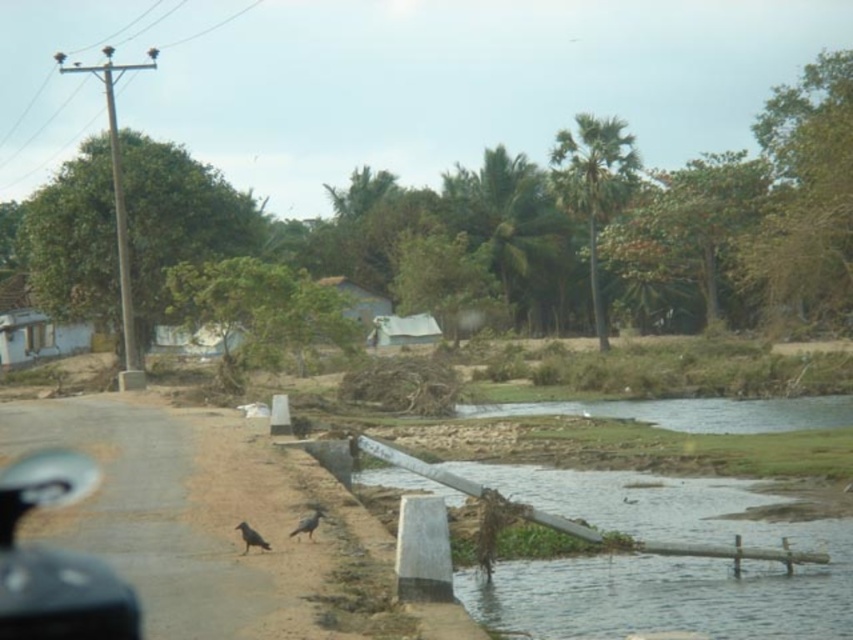
Does black rubber handlebar at lower left appear over gray matte bird at lower center?

Actually, black rubber handlebar at lower left is below gray matte bird at lower center.

Who is higher up, black rubber handlebar at lower left or gray matte bird at lower center?

gray matte bird at lower center is higher up.

Is point (33, 500) closer to camera compared to point (323, 515)?

That is False.

Find the location of a particular element. Image resolution: width=853 pixels, height=640 pixels. black rubber handlebar at lower left is located at coordinates (56, 561).

Is black rubber handlebar at lower left further to the viewer compared to dark gray feathered bird at lower left?

No, black rubber handlebar at lower left is in front of dark gray feathered bird at lower left.

Does point (51, 456) lie in front of point (258, 545)?

No.

Image resolution: width=853 pixels, height=640 pixels. What do you see at coordinates (56, 561) in the screenshot?
I see `black rubber handlebar at lower left` at bounding box center [56, 561].

What are the coordinates of `black rubber handlebar at lower left` in the screenshot? It's located at (56, 561).

Can you confirm if gray matte bird at lower center is taller than dark gray feathered bird at lower left?

No.

Who is positioned more to the right, gray matte bird at lower center or dark gray feathered bird at lower left?

From the viewer's perspective, gray matte bird at lower center appears more on the right side.

Measure the distance between gray matte bird at lower center and camera.

11.26 meters

This screenshot has height=640, width=853. Identify the location of gray matte bird at lower center. click(306, 524).